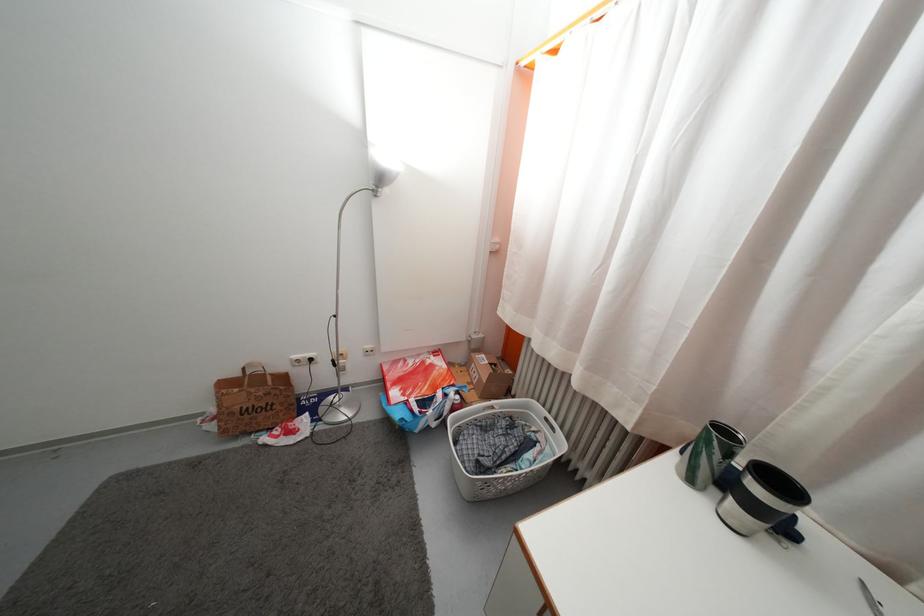
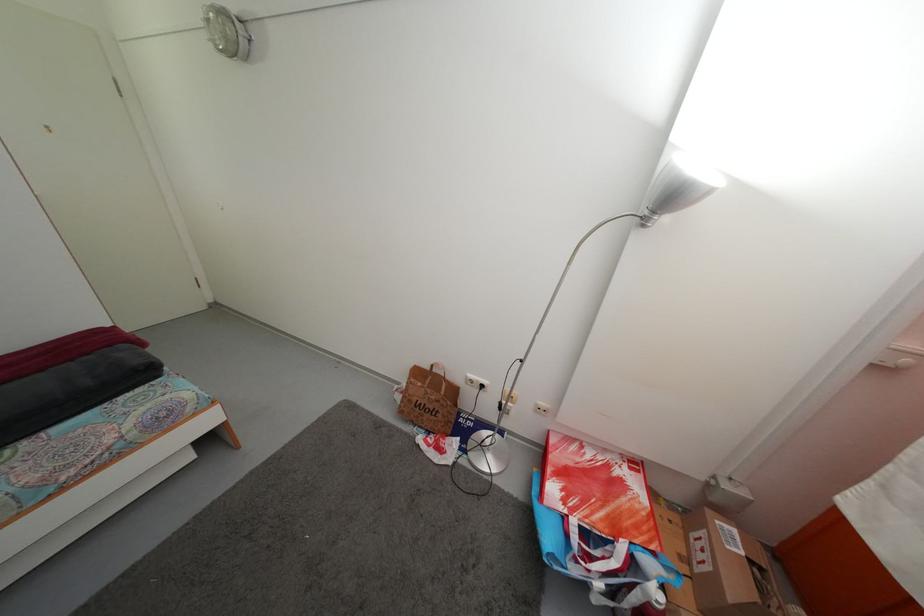
Question: Based on the continuous images, in which direction is the camera rotating? Reply with the corresponding letter.

Choices:
 (A) Left
 (B) Right
 (C) Up
 (D) Down

Answer: (A)